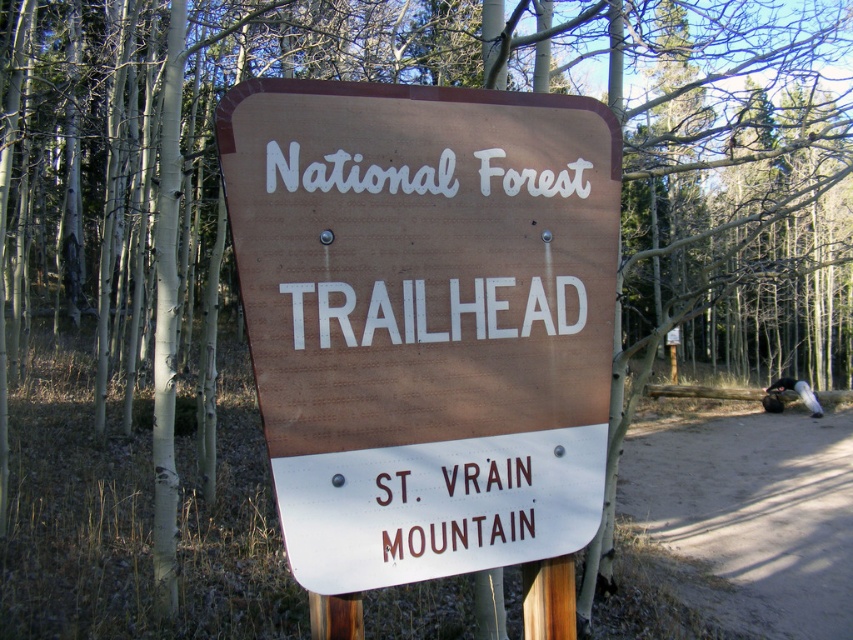
You are planning to hike and need to know if the brown wood trailhead sign at center is large enough to be seen from the dirt path at lower right. Based on the scene, can you determine if the sign is visible from the path?

The brown wood trailhead sign at center is smaller than the dirt path at lower right. Since the sign is smaller, it might be harder to see from a distance, but its position at the center and the open forest area could still make it visible depending on the distance and line of sight.

Looking at this image, you are standing at the trailhead and want to find the dirt path at lower right. Based on the scene, where should you look relative to the brown wood trailhead sign at center?

The dirt path at lower right is located below the brown wood trailhead sign at center, so you should look downward or towards the lower area near the sign.

You are standing at the coordinates 0.500, 0.499 in a forest. There is a brown wood trailhead sign at center. Can you see the sign from your current position?

Yes, the brown wood trailhead sign at center is located exactly at your current coordinates (425, 320), so you are right at the sign and can see it clearly.